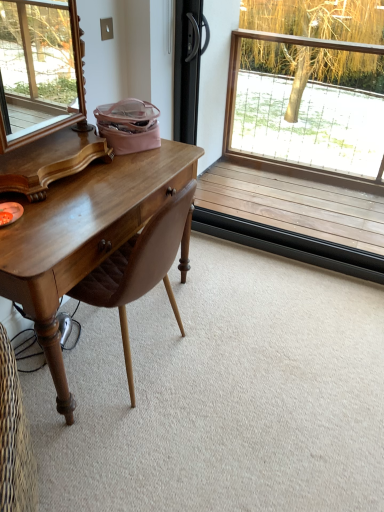
Question: Considering the positions of wooden frame at upper right and brown leather chair at left in the image, is wooden frame at upper right wider or thinner than brown leather chair at left?

Choices:
 (A) thin
 (B) wide

Answer: (A)

Question: Is point (322, 76) closer or farther from the camera than point (104, 271)?

Choices:
 (A) closer
 (B) farther

Answer: (B)

Question: From their relative heights in the image, would you say wooden frame at upper right is taller or shorter than brown leather chair at left?

Choices:
 (A) short
 (B) tall

Answer: (B)

Question: From the image's perspective, is brown leather chair at left located above or below wooden frame at upper right?

Choices:
 (A) below
 (B) above

Answer: (A)

Question: Is brown leather chair at left inside or outside of wooden frame at upper right?

Choices:
 (A) outside
 (B) inside

Answer: (A)

Question: In terms of height, does brown leather chair at left look taller or shorter compared to wooden frame at upper right?

Choices:
 (A) tall
 (B) short

Answer: (B)

Question: In the image, is brown leather chair at left positioned in front of or behind wooden frame at upper right?

Choices:
 (A) behind
 (B) front

Answer: (B)